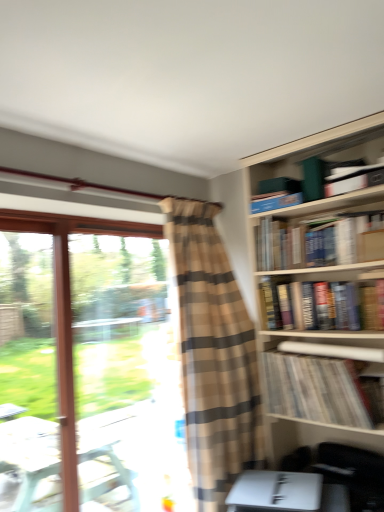
Question: Is white paper at center-right, acting as the fifth book starting from the top, wider than brown plaid curtain at center?

Choices:
 (A) no
 (B) yes

Answer: (A)

Question: Does white paper at center-right, placed as the 2th book when sorted from bottom to top, have a larger size compared to brown plaid curtain at center?

Choices:
 (A) no
 (B) yes

Answer: (A)

Question: Does white paper at center-right, acting as the fifth book starting from the top, have a smaller size compared to brown plaid curtain at center?

Choices:
 (A) yes
 (B) no

Answer: (A)

Question: Does white paper at center-right, placed as the 2th book when sorted from bottom to top, come in front of brown plaid curtain at center?

Choices:
 (A) no
 (B) yes

Answer: (A)

Question: Is white paper at center-right, placed as the 2th book when sorted from bottom to top, turned away from brown plaid curtain at center?

Choices:
 (A) no
 (B) yes

Answer: (A)

Question: From a real-world perspective, is clear glass window at left positioned above or below white paper at center-right, acting as the fifth book starting from the top?

Choices:
 (A) below
 (B) above

Answer: (A)

Question: Is clear glass window at left inside or outside of white paper at center-right, acting as the fifth book starting from the top?

Choices:
 (A) inside
 (B) outside

Answer: (B)

Question: Is point (61, 380) positioned closer to the camera than point (314, 343)?

Choices:
 (A) closer
 (B) farther

Answer: (B)

Question: In terms of height, does clear glass window at left look taller or shorter compared to white paper at center-right, placed as the 2th book when sorted from bottom to top?

Choices:
 (A) tall
 (B) short

Answer: (A)

Question: Do you think hardcover book at upper right, marked as the fourth book in a bottom-to-top arrangement, is within striped paper at upper right, which ranks as the 6th book in top-to-bottom order, or outside of it?

Choices:
 (A) outside
 (B) inside

Answer: (A)

Question: Looking at the image, does hardcover book at upper right, which is the 3th book from top to bottom, seem bigger or smaller compared to striped paper at upper right, the 1th book in the bottom-to-top sequence?

Choices:
 (A) big
 (B) small

Answer: (A)

Question: Does point (334, 240) appear closer or farther from the camera than point (304, 364)?

Choices:
 (A) farther
 (B) closer

Answer: (A)

Question: Considering the positions of hardcover book at upper right, marked as the fourth book in a bottom-to-top arrangement, and striped paper at upper right, the 1th book in the bottom-to-top sequence, in the image, is hardcover book at upper right, marked as the fourth book in a bottom-to-top arrangement, wider or thinner than striped paper at upper right, the 1th book in the bottom-to-top sequence,?

Choices:
 (A) wide
 (B) thin

Answer: (B)

Question: Considering the positions of hardcover books at upper right, placed as the 3th book when sorted from bottom to top, and brown plaid curtain at center in the image, is hardcover books at upper right, placed as the 3th book when sorted from bottom to top, bigger or smaller than brown plaid curtain at center?

Choices:
 (A) small
 (B) big

Answer: (A)

Question: Based on their positions, is hardcover books at upper right, marked as the 4th book in a top-to-bottom arrangement, located to the left or right of brown plaid curtain at center?

Choices:
 (A) left
 (B) right

Answer: (B)